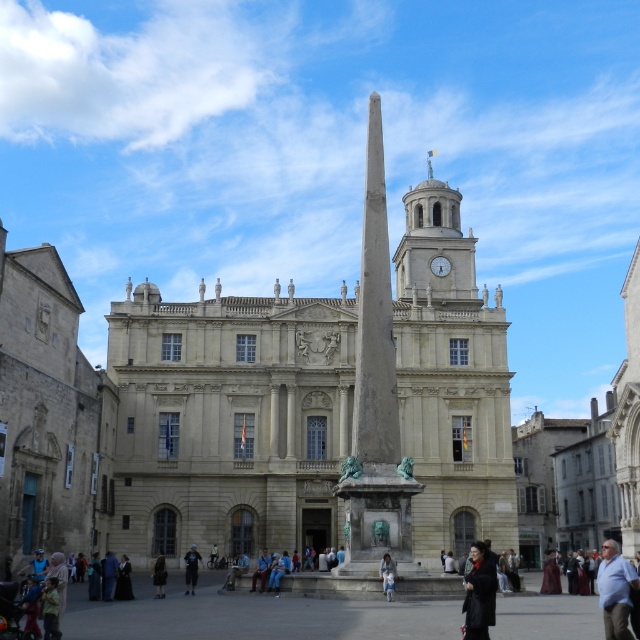
Can you confirm if gray stone obelisk at center is shorter than blue denim jeans at center?

No, gray stone obelisk at center is not shorter than blue denim jeans at center.

Is gray stone obelisk at center to the right of blue denim jeans at center from the viewer's perspective?

Correct, you'll find gray stone obelisk at center to the right of blue denim jeans at center.

The image size is (640, 640). What are the coordinates of `gray stone obelisk at center` in the screenshot? It's located at (376, 397).

Locate an element on the screen. gray stone obelisk at center is located at coordinates (376, 397).

Is gray stone obelisk at center taller than dark gray fabric coat at center?

Indeed, gray stone obelisk at center has a greater height compared to dark gray fabric coat at center.

What do you see at coordinates (376, 397) in the screenshot? This screenshot has width=640, height=640. I see `gray stone obelisk at center` at bounding box center [376, 397].

Is point (371, 572) farther from viewer compared to point (161, 554)?

No, it is in front of (161, 554).

In order to click on gray stone obelisk at center in this screenshot , I will do `click(376, 397)`.

Does light blue shirt at lower right appear over dark gray fabric coat at center?

Indeed, light blue shirt at lower right is positioned over dark gray fabric coat at center.

Does light blue shirt at lower right have a lesser height compared to dark gray fabric coat at center?

A: Incorrect, light blue shirt at lower right's height does not fall short of dark gray fabric coat at center's.

Is point (611, 573) positioned before point (154, 580)?

Yes, it is in front of point (154, 580).

Identify the location of light blue shirt at lower right. (616, 589).